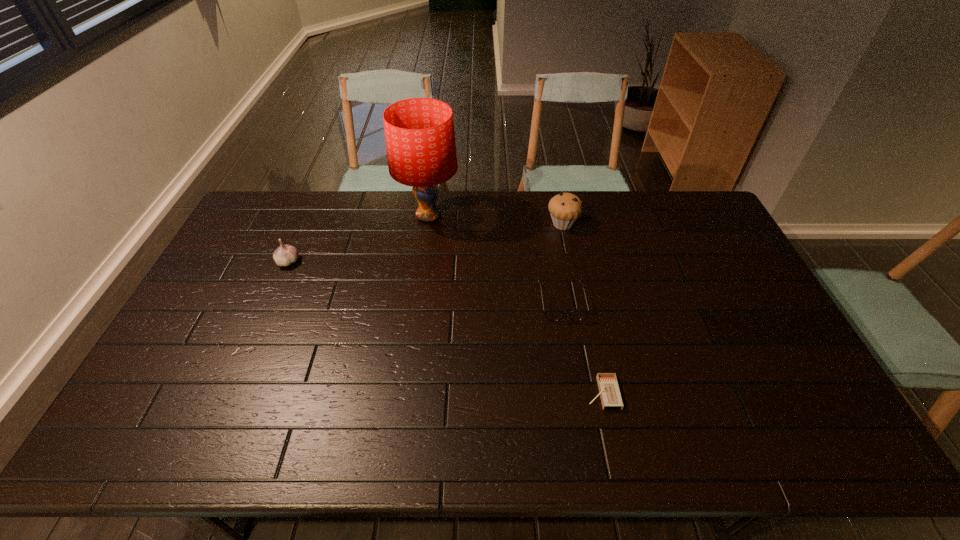
I want to click on free space between the second shortest object and the third farthest object, so click(425, 282).

In order to click on vacant region between the third nearest object and the second shortest object in this screenshot , I will do `click(425, 282)`.

What are the coordinates of `vacant region between the fourth shortest object and the nearest object` in the screenshot? It's located at (583, 308).

Locate an element on the screen. unoccupied position between the muffin and the matchbox is located at coordinates (583, 308).

Find the location of a particular element. The height and width of the screenshot is (540, 960). free spot between the second nearest object and the third farthest object is located at coordinates (425, 282).

Locate which object ranks fourth in proximity to the spectacles. Please provide its 2D coordinates. Your answer should be formatted as a tuple, i.e. [(x, y)], where the tuple contains the x and y coordinates of a point satisfying the conditions above.

[(285, 255)]

Where is `object that can be found as the second closest to the muffin`? The width and height of the screenshot is (960, 540). object that can be found as the second closest to the muffin is located at coordinates (420, 140).

This screenshot has width=960, height=540. Find the location of `vacant space that satisfies the following two spatial constraints: 1. on the front-facing side of the second tallest object; 2. on the left side of the tallest object`. vacant space that satisfies the following two spatial constraints: 1. on the front-facing side of the second tallest object; 2. on the left side of the tallest object is located at coordinates (427, 224).

The height and width of the screenshot is (540, 960). Identify the location of free space that satisfies the following two spatial constraints: 1. on the front-facing side of the muffin; 2. on the right side of the second object from left to right. (427, 224).

Locate an element on the screen. The height and width of the screenshot is (540, 960). vacant position in the image that satisfies the following two spatial constraints: 1. on the front-facing side of the fourth shortest object; 2. on the left side of the lampshade is located at coordinates (427, 224).